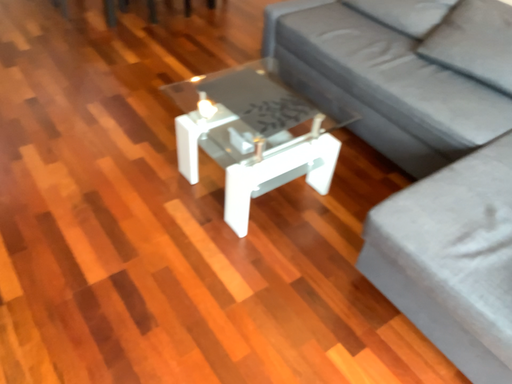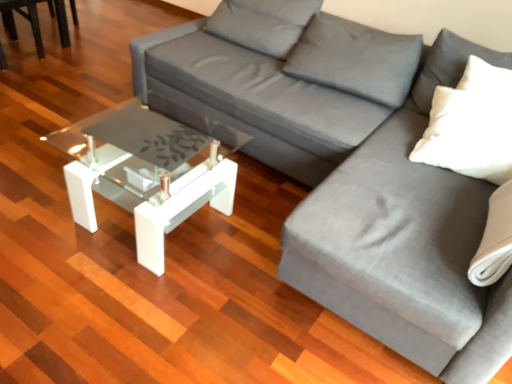
Question: How did the camera likely rotate when shooting the video?

Choices:
 (A) rotated right
 (B) rotated left

Answer: (A)